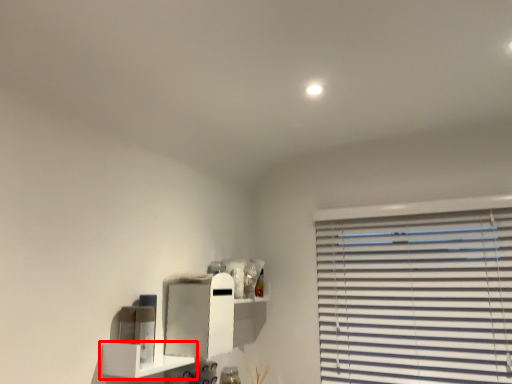
Question: From the image's perspective, what is the correct spatial relationship of shelf (annotated by the red box) in relation to cabinet?

Choices:
 (A) below
 (B) above

Answer: (A)